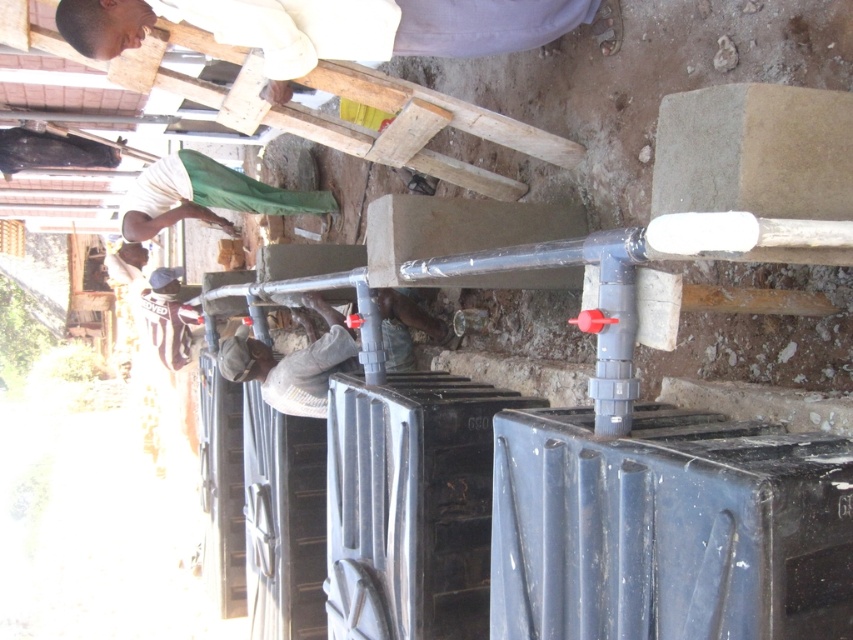
Question: Does light brown wooden plank at upper center have a lesser width compared to dark gray concrete man at center?

Choices:
 (A) no
 (B) yes

Answer: (A)

Question: Which object is the closest to the dark gray concrete man at center?

Choices:
 (A) light brown wooden plank at upper center
 (B) white matte shirt at upper left

Answer: (A)

Question: Which point appears closest to the camera in this image?

Choices:
 (A) (x=107, y=1)
 (B) (x=164, y=204)
 (C) (x=322, y=298)

Answer: (A)

Question: Which object appears farthest from the camera in this image?

Choices:
 (A) light brown wooden plank at upper center
 (B) dark gray concrete man at center

Answer: (B)

Question: Does light brown wooden plank at upper center have a greater width compared to dark gray concrete man at center?

Choices:
 (A) yes
 (B) no

Answer: (A)

Question: Is light brown wooden plank at upper center in front of white matte shirt at upper left?

Choices:
 (A) yes
 (B) no

Answer: (A)